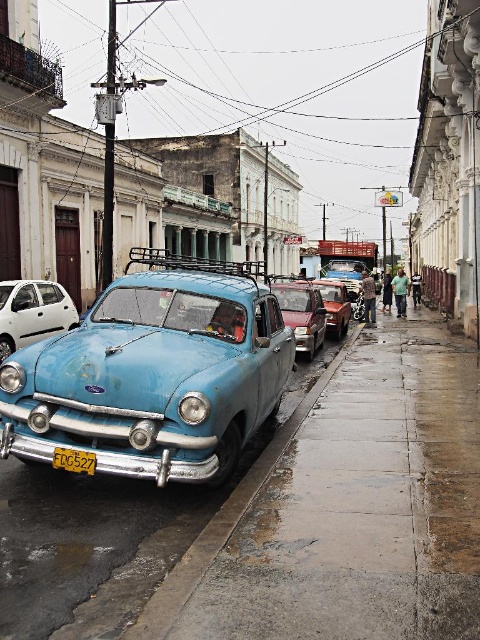
You are a delivery person needing to park your 2.5 meter wide truck next to the rusty metal car at center. The yellow matte license plate at center indicates parking restrictions. Can you safely park your truck without overlapping the license plate area?

The rusty metal car at center might be wider than yellow matte license plate at center, so it is uncertain whether there will be enough space. Check the width of the rusty metal car at center before deciding to park.

You are a delivery person who needs to load a package onto a truck. The truck has a loading ramp that can only accommodate items no taller than the yellow matte license plate at center. Can the white matte car at left fit through the ramp?

The white matte car at left is taller than the yellow matte license plate at center, so it cannot fit through the loading ramp which has a height limit based on the yellow matte license plate at center.